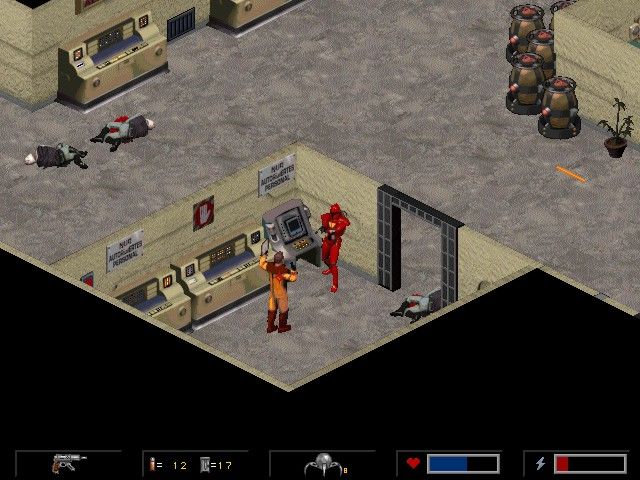
Identify the location of corner to the other room on the top right. The height and width of the screenshot is (480, 640). (624, 71).